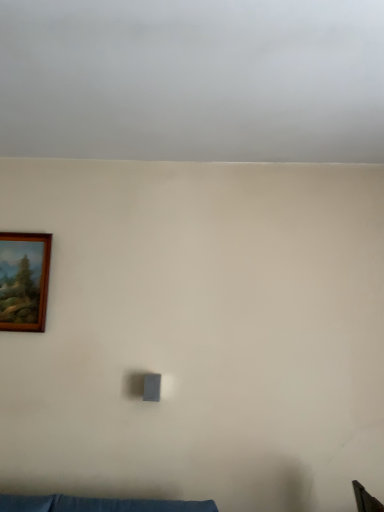
Question: Is gray matte cloud at upper center turned away from wooden picture frame at upper left?

Choices:
 (A) yes
 (B) no

Answer: (B)

Question: From a real-world perspective, is gray matte cloud at upper center over wooden picture frame at upper left?

Choices:
 (A) no
 (B) yes

Answer: (B)

Question: From the image's perspective, is gray matte cloud at upper center on top of wooden picture frame at upper left?

Choices:
 (A) no
 (B) yes

Answer: (B)

Question: Does gray matte cloud at upper center have a larger size compared to wooden picture frame at upper left?

Choices:
 (A) no
 (B) yes

Answer: (B)

Question: Does gray matte cloud at upper center have a lesser height compared to wooden picture frame at upper left?

Choices:
 (A) no
 (B) yes

Answer: (B)

Question: Is gray matte cloud at upper center at the right side of wooden picture frame at upper left?

Choices:
 (A) no
 (B) yes

Answer: (B)

Question: Is wooden picture frame at upper left oriented towards gray matte cloud at upper center?

Choices:
 (A) yes
 (B) no

Answer: (B)

Question: Considering the relative sizes of wooden picture frame at upper left and gray matte cloud at upper center in the image provided, is wooden picture frame at upper left bigger than gray matte cloud at upper center?

Choices:
 (A) yes
 (B) no

Answer: (B)

Question: From the image's perspective, is wooden picture frame at upper left located above gray matte cloud at upper center?

Choices:
 (A) no
 (B) yes

Answer: (A)

Question: From a real-world perspective, is wooden picture frame at upper left under gray matte cloud at upper center?

Choices:
 (A) no
 (B) yes

Answer: (B)

Question: Is wooden picture frame at upper left shorter than gray matte cloud at upper center?

Choices:
 (A) yes
 (B) no

Answer: (B)

Question: Considering the relative sizes of wooden picture frame at upper left and gray matte cloud at upper center in the image provided, is wooden picture frame at upper left taller than gray matte cloud at upper center?

Choices:
 (A) no
 (B) yes

Answer: (B)

Question: Based on their positions, is gray matte cloud at upper center located to the left or right of wooden picture frame at upper left?

Choices:
 (A) right
 (B) left

Answer: (A)